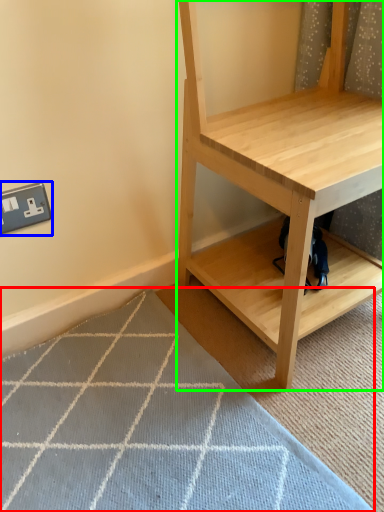
Question: Based on their relative distances, which object is farther from doormat (highlighted by a red box)? Choose from electric outlet (highlighted by a blue box) and shelf (highlighted by a green box).

Choices:
 (A) electric outlet
 (B) shelf

Answer: (A)